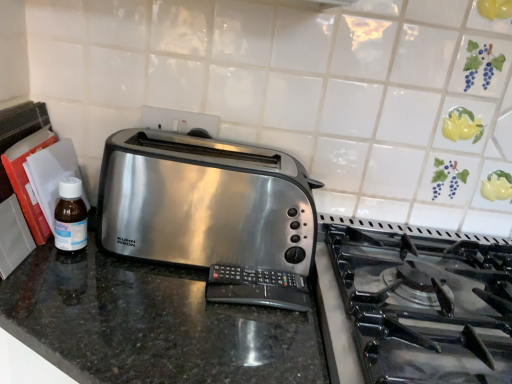
Where is `free spot in front of satin metallic toaster at center`? This screenshot has height=384, width=512. free spot in front of satin metallic toaster at center is located at coordinates (174, 331).